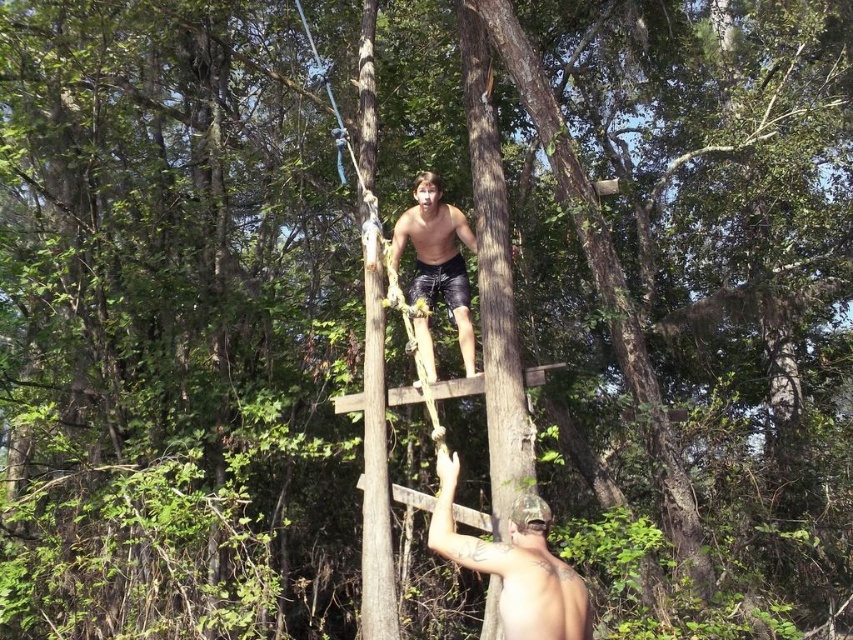
You are a safety inspector checking the scene. The shiny silver helmet at lower right is required safety gear. Can you reach it from your current position without moving?

The shiny silver helmet at lower right is 12.94 feet away from camera, so it is too far to reach without moving closer.